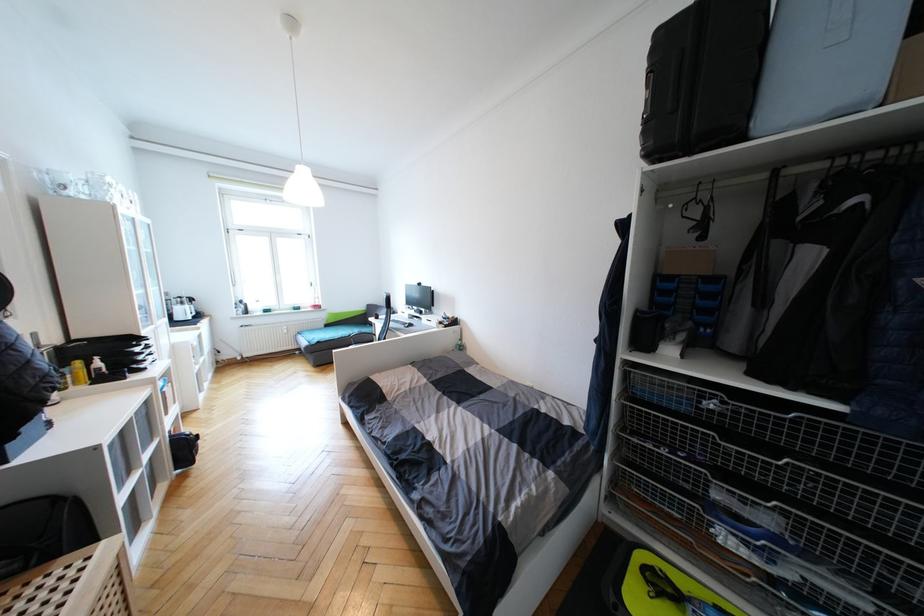
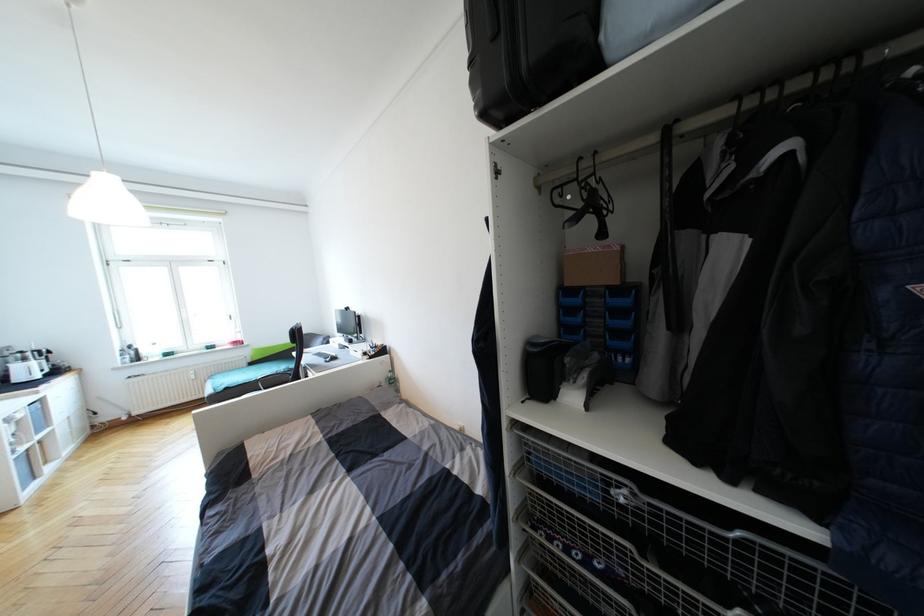
Find the pixel in the second image that matches (x=702, y=277) in the first image.

(611, 288)